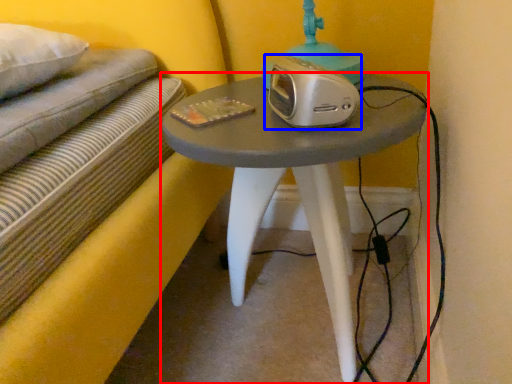
Question: Which object appears closest to the camera in this image, table (highlighted by a red box) or stereo (highlighted by a blue box)?

Choices:
 (A) table
 (B) stereo

Answer: (A)